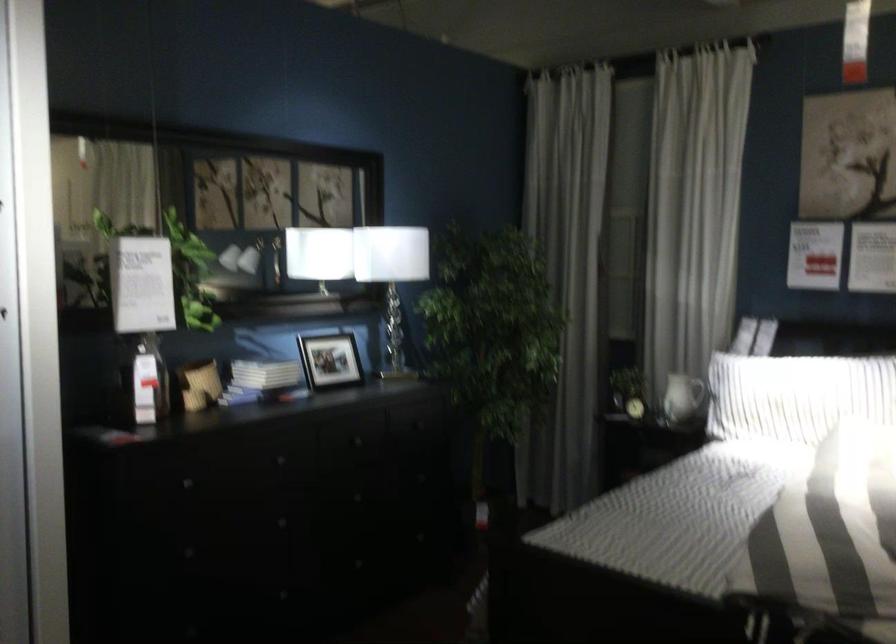
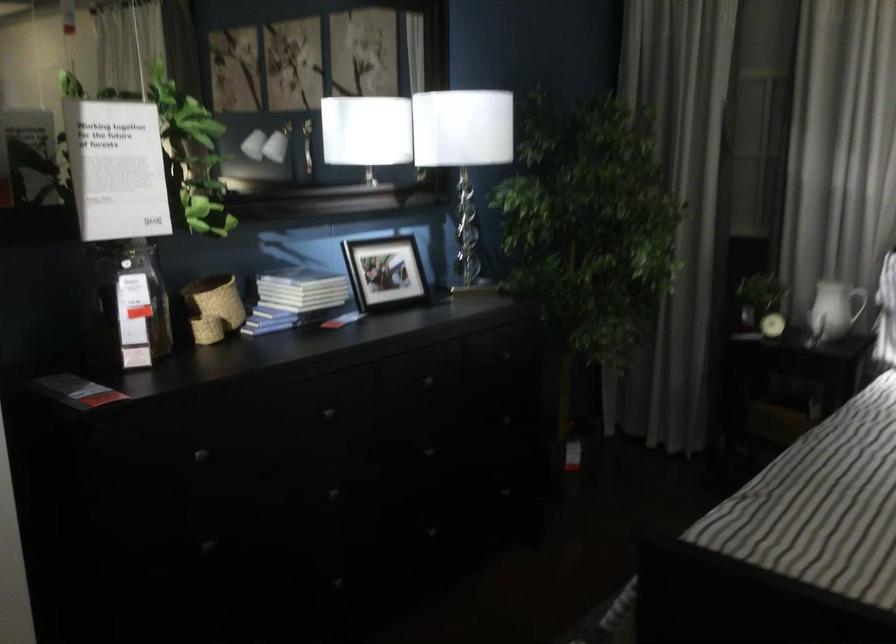
Find the pixel in the second image that matches (188,487) in the first image.

(200, 456)